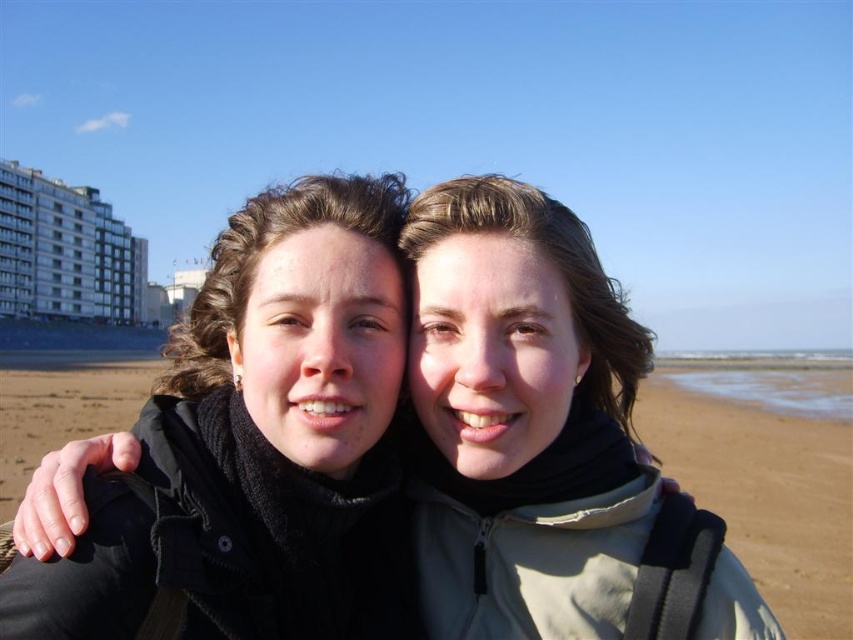
Between black matte jacket at left and matte black jacket at center, which one appears on the left side from the viewer's perspective?

black matte jacket at left is more to the left.

The width and height of the screenshot is (853, 640). Describe the element at coordinates (258, 445) in the screenshot. I see `black matte jacket at left` at that location.

Find the location of `black matte jacket at left`. black matte jacket at left is located at coordinates (258, 445).

Find the location of a particular element. The width and height of the screenshot is (853, 640). black matte jacket at left is located at coordinates (258, 445).

Identify the location of matte black jacket at center. Image resolution: width=853 pixels, height=640 pixels. (521, 419).

Which is in front, point (592, 440) or point (71, 397)?

Positioned in front is point (592, 440).

The height and width of the screenshot is (640, 853). I want to click on matte black jacket at center, so click(x=521, y=419).

Who is more forward, (254, 637) or (805, 595)?

Point (254, 637) is more forward.

Does black matte jacket at left have a larger size compared to brown sand at center?

No, black matte jacket at left is not bigger than brown sand at center.

Which is in front, point (252, 429) or point (772, 454)?

Point (252, 429)

Find the location of a particular element. The image size is (853, 640). black matte jacket at left is located at coordinates (x=258, y=445).